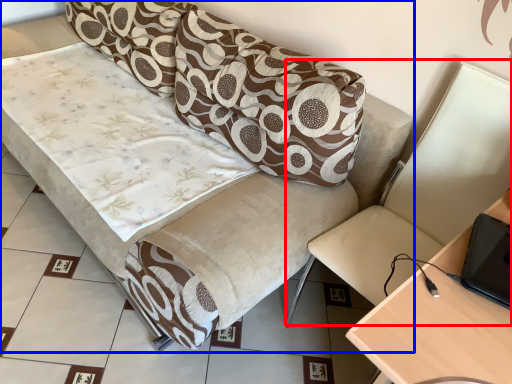
Question: Which of the following is the farthest to the observer, swivel chair (highlighted by a red box) or studio couch (highlighted by a blue box)?

Choices:
 (A) swivel chair
 (B) studio couch

Answer: (B)